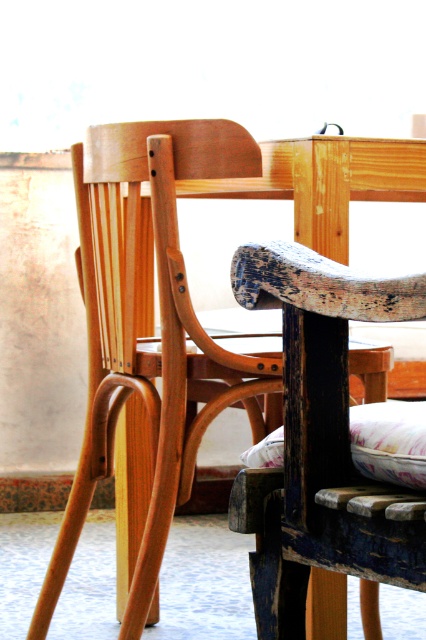
What are the coordinates of the natural wood chair at center?

The natural wood chair at center is located at coordinates point (x=161, y=317).

You are setting up a small outdoor seating area and have both the natural wood chair at center and the floral fabric cushion at lower center. Which object would be more suitable for placing the cushion on to create a comfortable seating spot?

The natural wood chair at center has a larger size compared to the floral fabric cushion at lower center, making it a more suitable base for placing the cushion to create a comfortable seating spot.

What object is located at the coordinates point (161, 317) in the image?

The point (161, 317) corresponds to the natural wood chair at center.